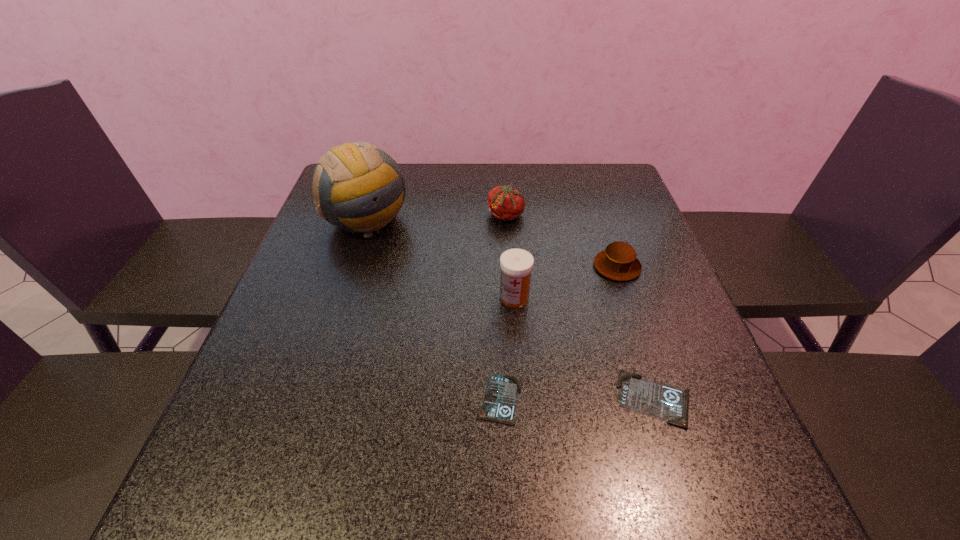
In order to click on free space between the taller identity card and the fourth nearest object in this screenshot , I will do `click(636, 333)`.

You are a GUI agent. You are given a task and a screenshot of the screen. Output one action in this format:
    pyautogui.click(x=<x>, y=<y>)
    Task: Click on the vacant area that lies between the second tallest object and the left identity card
    
    Given the screenshot: What is the action you would take?
    coord(508,348)

This screenshot has width=960, height=540. I want to click on vacant area that lies between the fourth tallest object and the taller identity card, so click(x=636, y=333).

Find the location of a particular element. free space between the fourth shortest object and the third shortest object is located at coordinates (562, 241).

Where is `vacant area that lies between the volleyball and the third tallest object`? This screenshot has width=960, height=540. vacant area that lies between the volleyball and the third tallest object is located at coordinates (436, 218).

You are a GUI agent. You are given a task and a screenshot of the screen. Output one action in this format:
    pyautogui.click(x=<x>, y=<y>)
    Task: Click on the blank region between the third shortest object and the fourth shortest object
    The image size is (960, 540).
    Given the screenshot: What is the action you would take?
    pyautogui.click(x=562, y=241)

Identify the location of vacant space that is in between the volleyball and the right identity card. The image size is (960, 540). (511, 309).

Locate which object is the third closest to the volleyball. Please provide its 2D coordinates. Your answer should be formatted as a tuple, i.e. [(x, y)], where the tuple contains the x and y coordinates of a point satisfying the conditions above.

[(499, 403)]

At what (x,y) coordinates should I click in order to perform the action: click on the fourth closest object to the left identity card. Please return your answer as a coordinate pair (x, y). This screenshot has width=960, height=540. Looking at the image, I should click on (359, 187).

The width and height of the screenshot is (960, 540). In order to click on vacant point that satisfies the following two spatial constraints: 1. on the back side of the fourth nearest object; 2. on the right side of the taller identity card in this screenshot , I will do `click(612, 266)`.